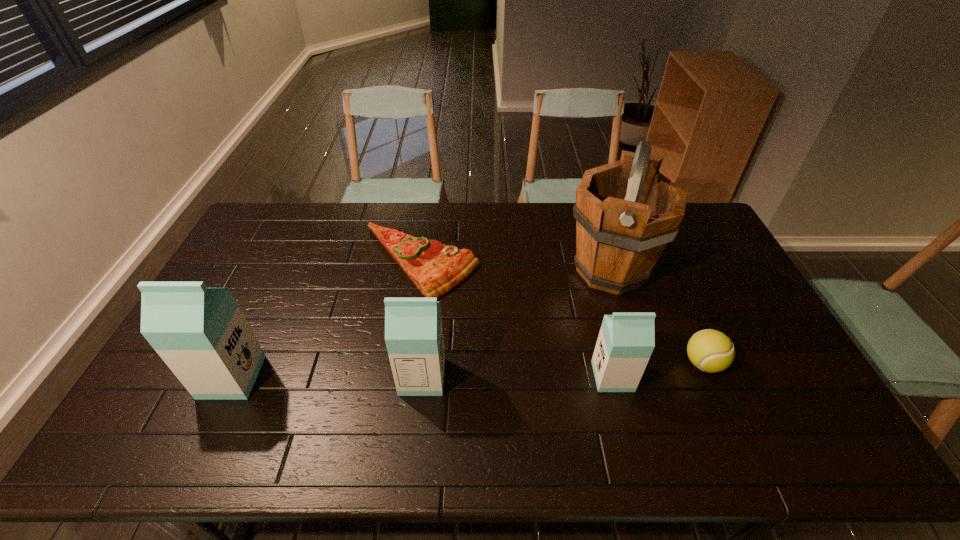
This screenshot has height=540, width=960. In the image, there is a desktop. Identify the location of free space at the right edge. (730, 289).

In the image, there is a desktop. Where is `free space at the far left corner`? The width and height of the screenshot is (960, 540). free space at the far left corner is located at coordinates (278, 229).

Image resolution: width=960 pixels, height=540 pixels. I want to click on unoccupied position between the shortest object and the shortest milk carton, so click(x=516, y=319).

Identify the location of empty location between the shortest object and the leftmost milk carton. (325, 320).

You are a GUI agent. You are given a task and a screenshot of the screen. Output one action in this format:
    pyautogui.click(x=<x>, y=<y>)
    Task: Click on the free space between the tennis ball and the leftmost object
    The image size is (960, 540).
    Given the screenshot: What is the action you would take?
    pyautogui.click(x=468, y=370)

Locate an element on the screen. Image resolution: width=960 pixels, height=540 pixels. vacant space in between the third tallest object and the tennis ball is located at coordinates (563, 370).

I want to click on free point between the fifth tallest object and the leftmost milk carton, so click(x=468, y=370).

At what (x,y) coordinates should I click in order to perform the action: click on free spot between the tennis ball and the pizza. Please return your answer as a coordinate pair (x, y). Looking at the image, I should click on (562, 313).

Image resolution: width=960 pixels, height=540 pixels. Find the location of `empty space between the third tallest object and the tennis ball`. empty space between the third tallest object and the tennis ball is located at coordinates (563, 370).

You are a GUI agent. You are given a task and a screenshot of the screen. Output one action in this format:
    pyautogui.click(x=<x>, y=<y>)
    Task: Click on the vacant space that is in between the pizza and the tennis ball
    The width and height of the screenshot is (960, 540).
    Given the screenshot: What is the action you would take?
    pyautogui.click(x=562, y=313)